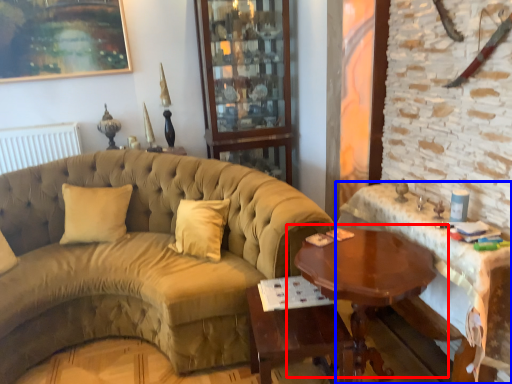
Question: Which object is closer to the camera taking this photo, table (highlighted by a red box) or table (highlighted by a blue box)?

Choices:
 (A) table
 (B) table

Answer: (B)